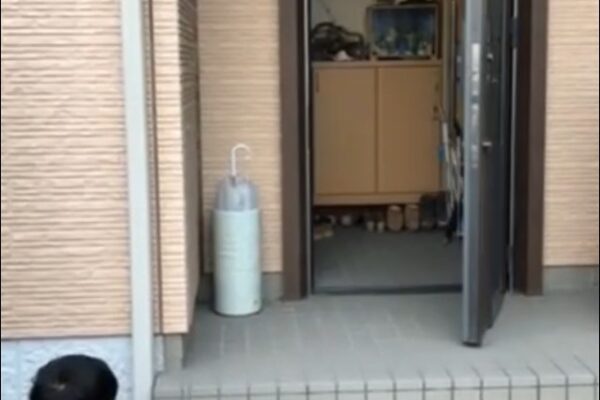
Locate an element on the screen. grey door is located at coordinates (486, 217).